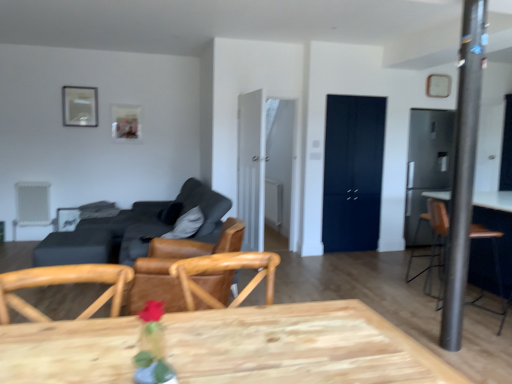
Question: Considering the positions of wooden table at lower left and metallic silver picture frame at upper left, the 1th picture frame from the left, in the image, is wooden table at lower left taller or shorter than metallic silver picture frame at upper left, the 1th picture frame from the left,?

Choices:
 (A) short
 (B) tall

Answer: (A)

Question: Is wooden table at lower left in front of or behind metallic silver picture frame at upper left, the 3th picture frame positioned from the right, in the image?

Choices:
 (A) behind
 (B) front

Answer: (B)

Question: Which object is the closest to the dark gray fabric couch at center-left?

Choices:
 (A) brown leather armchair at right, which appears as the 2th armchair when viewed from the back
 (B) brown leather chair at center
 (C) metallic silver picture frame at upper left, the 1th picture frame from the left
 (D) wooden table at lower left
 (E) satin black refrigerator at right

Answer: (D)

Question: Which object is the closest to the leather armchair at left, placed as the 1th armchair when sorted from back to front?

Choices:
 (A) wooden table at lower left
 (B) satin black refrigerator at right
 (C) brown leather armchair at right, which appears as the 1th armchair when viewed from the front
 (D) brown leather chair at center
 (E) metallic pole at right

Answer: (A)